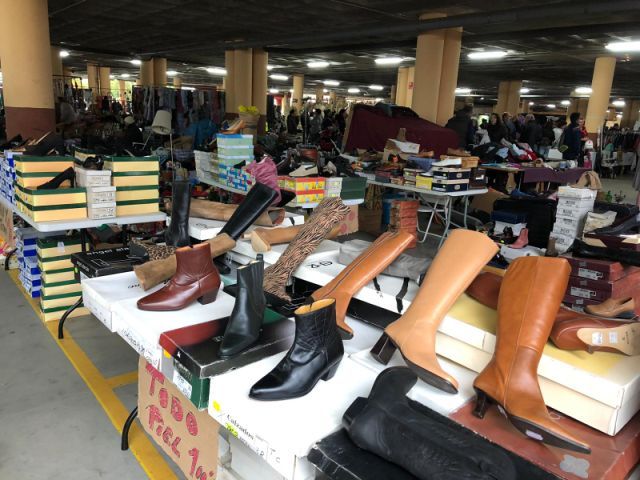
Locate an element on the screen. The height and width of the screenshot is (480, 640). store lights is located at coordinates (388, 60), (486, 56), (628, 41).